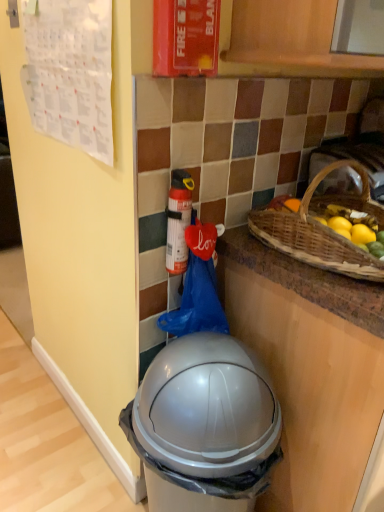
What do you see at coordinates (204, 425) in the screenshot? This screenshot has width=384, height=512. I see `silver plastic trash can at lower center` at bounding box center [204, 425].

Describe the element at coordinates (186, 37) in the screenshot. I see `red matte fire extinguisher at upper center` at that location.

Image resolution: width=384 pixels, height=512 pixels. In order to click on brown woven picnic basket at upper right in this screenshot , I will do `click(322, 229)`.

Locate an element on the screen. red matte fire extinguisher at center is located at coordinates (178, 221).

Image resolution: width=384 pixels, height=512 pixels. I want to click on silver plastic trash can at lower center, so click(204, 425).

Is red matte fire extinguisher at upper center positioned with its back to red matte fire extinguisher at center?

No, red matte fire extinguisher at upper center's orientation is not away from red matte fire extinguisher at center.

In terms of size, does red matte fire extinguisher at upper center appear bigger or smaller than red matte fire extinguisher at center?

In the image, red matte fire extinguisher at upper center appears to be larger than red matte fire extinguisher at center.

How much distance is there between red matte fire extinguisher at upper center and red matte fire extinguisher at center?

The distance of red matte fire extinguisher at upper center from red matte fire extinguisher at center is 12.66 inches.

Can you tell me how much red matte fire extinguisher at upper center and red matte fire extinguisher at center differ in facing direction?

The facing directions of red matte fire extinguisher at upper center and red matte fire extinguisher at center are 3 degrees apart.

From their relative heights in the image, would you say silver plastic trash can at lower center is taller or shorter than red matte fire extinguisher at center?

Considering their sizes, silver plastic trash can at lower center has more height than red matte fire extinguisher at center.

From a real-world perspective, who is located higher, silver plastic trash can at lower center or red matte fire extinguisher at center?

red matte fire extinguisher at center is physically above.

Which object is positioned more to the left, silver plastic trash can at lower center or red matte fire extinguisher at center?

Positioned to the left is red matte fire extinguisher at center.

Between point (146, 407) and point (332, 200), which one is positioned behind?

The point (332, 200) is behind.

Visually, is silver plastic trash can at lower center positioned to the left or to the right of brown woven picnic basket at upper right?

silver plastic trash can at lower center is to the left of brown woven picnic basket at upper right.

From the image's perspective, is silver plastic trash can at lower center beneath brown woven picnic basket at upper right?

Correct, silver plastic trash can at lower center appears lower than brown woven picnic basket at upper right in the image.

In the scene shown: Is the position of red matte fire extinguisher at center less distant than that of silver plastic trash can at lower center?

No, red matte fire extinguisher at center is further to the viewer.

Would you say red matte fire extinguisher at center contains silver plastic trash can at lower center?

No, silver plastic trash can at lower center is located outside of red matte fire extinguisher at center.

Is red matte fire extinguisher at center oriented towards silver plastic trash can at lower center?

No, red matte fire extinguisher at center is not oriented towards silver plastic trash can at lower center.

Is point (210, 422) farther from camera compared to point (163, 30)?

Yes.

Looking at this image, is the depth of silver plastic trash can at lower center greater than that of red matte fire extinguisher at upper center?

No, silver plastic trash can at lower center is in front of red matte fire extinguisher at upper center.

Is silver plastic trash can at lower center outside of red matte fire extinguisher at upper center?

Indeed, silver plastic trash can at lower center is completely outside red matte fire extinguisher at upper center.

Find the location of `fire extinguisher on the left of silver plastic trash can at lower center`. fire extinguisher on the left of silver plastic trash can at lower center is located at coordinates (186, 37).

Considering the relative positions of brown woven picnic basket at upper right and red matte fire extinguisher at upper center in the image provided, is brown woven picnic basket at upper right to the left of red matte fire extinguisher at upper center from the viewer's perspective?

Incorrect, brown woven picnic basket at upper right is not on the left side of red matte fire extinguisher at upper center.

From the picture: From the image's perspective, is brown woven picnic basket at upper right beneath red matte fire extinguisher at upper center?

Yes, from the image's perspective, brown woven picnic basket at upper right is below red matte fire extinguisher at upper center.

Which is in front, brown woven picnic basket at upper right or red matte fire extinguisher at upper center?

brown woven picnic basket at upper right is more forward.

Which is in front, point (283, 250) or point (169, 252)?

Point (283, 250)

Choose the correct answer: Is brown woven picnic basket at upper right inside red matte fire extinguisher at center or outside it?

brown woven picnic basket at upper right is not inside red matte fire extinguisher at center, it's outside.

Can you tell me how much brown woven picnic basket at upper right and red matte fire extinguisher at center differ in facing direction?

The angular difference between brown woven picnic basket at upper right and red matte fire extinguisher at center is 5.61 degrees.

Is brown woven picnic basket at upper right in front of or behind red matte fire extinguisher at center in the image?

Visually, brown woven picnic basket at upper right is located in front of red matte fire extinguisher at center.

What are the coordinates of `bottle below the red matte fire extinguisher at upper center (from the image's perspective)` in the screenshot? It's located at (178, 221).

The height and width of the screenshot is (512, 384). In order to click on trash bin/can located on the right of red matte fire extinguisher at center in this screenshot , I will do point(204,425).

Considering their positions, is red matte fire extinguisher at upper center positioned closer to red matte fire extinguisher at center than brown woven picnic basket at upper right?

Based on the image, brown woven picnic basket at upper right appears to be nearer to red matte fire extinguisher at center.

Which object lies further to the anchor point brown woven picnic basket at upper right, red matte fire extinguisher at center or silver plastic trash can at lower center?

silver plastic trash can at lower center is further to brown woven picnic basket at upper right.

From the image, which object appears to be nearer to silver plastic trash can at lower center, red matte fire extinguisher at center or brown woven picnic basket at upper right?

Among the two, red matte fire extinguisher at center is located nearer to silver plastic trash can at lower center.

From the picture: Estimate the real-world distances between objects in this image. Which object is further from brown woven picnic basket at upper right, red matte fire extinguisher at center or red matte fire extinguisher at upper center?

red matte fire extinguisher at upper center lies further to brown woven picnic basket at upper right than the other object.

Looking at the image, which one is located closer to red matte fire extinguisher at upper center, brown woven picnic basket at upper right or red matte fire extinguisher at center?

Among the two, red matte fire extinguisher at center is located nearer to red matte fire extinguisher at upper center.

Which object lies nearer to the anchor point red matte fire extinguisher at center, red matte fire extinguisher at upper center or silver plastic trash can at lower center?

red matte fire extinguisher at upper center lies closer to red matte fire extinguisher at center than the other object.

When comparing their distances from silver plastic trash can at lower center, does red matte fire extinguisher at center or red matte fire extinguisher at upper center seem further?

Based on the image, red matte fire extinguisher at upper center appears to be further to silver plastic trash can at lower center.

Estimate the real-world distances between objects in this image. Which object is further from red matte fire extinguisher at upper center, red matte fire extinguisher at center or silver plastic trash can at lower center?

Based on the image, silver plastic trash can at lower center appears to be further to red matte fire extinguisher at upper center.

Where is `picnic basket between red matte fire extinguisher at upper center and silver plastic trash can at lower center from top to bottom`? The image size is (384, 512). picnic basket between red matte fire extinguisher at upper center and silver plastic trash can at lower center from top to bottom is located at coordinates (322, 229).

At what (x,y) coordinates should I click in order to perform the action: click on bottle between brown woven picnic basket at upper right and silver plastic trash can at lower center vertically. Please return your answer as a coordinate pair (x, y). Looking at the image, I should click on [178, 221].

What are the coordinates of `picnic basket between red matte fire extinguisher at upper center and red matte fire extinguisher at center vertically` in the screenshot? It's located at [322, 229].

Find the location of a particular element. bottle between red matte fire extinguisher at upper center and silver plastic trash can at lower center in the up-down direction is located at coordinates (178, 221).